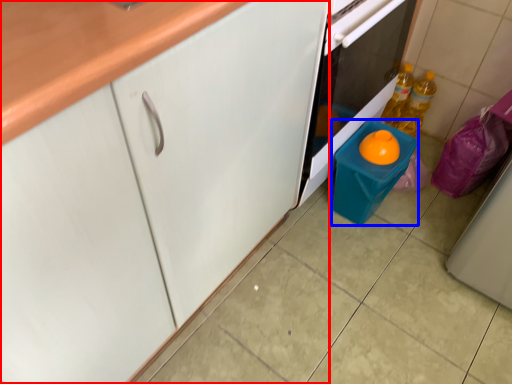
Question: Which point is closer to the camera, cabinetry (highlighted by a red box) or appliance (highlighted by a blue box)?

Choices:
 (A) cabinetry
 (B) appliance

Answer: (A)